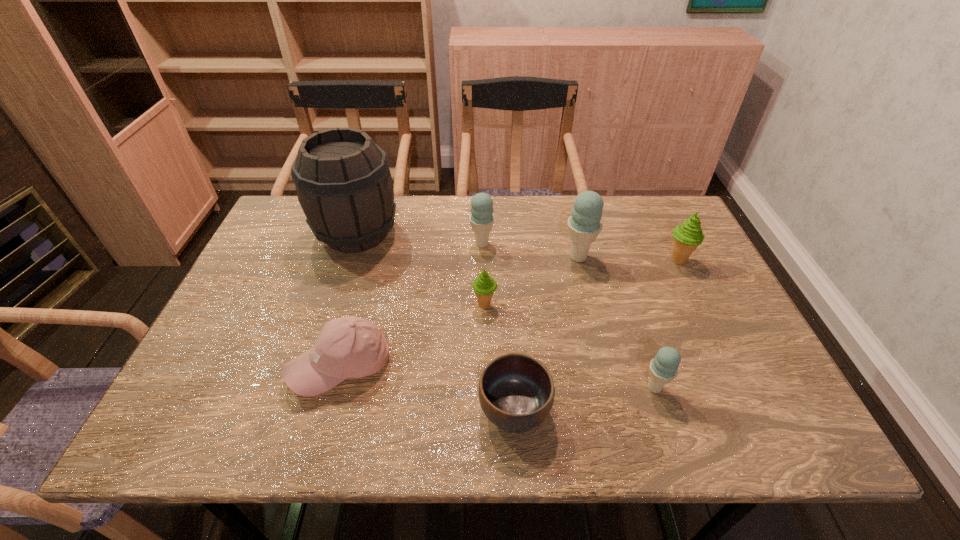
This screenshot has height=540, width=960. In order to click on wine bucket in this screenshot , I will do `click(343, 182)`.

The image size is (960, 540). I want to click on the third icecream from right to left, so click(584, 224).

This screenshot has height=540, width=960. I want to click on the third object from right to left, so click(x=584, y=224).

Image resolution: width=960 pixels, height=540 pixels. What are the coordinates of `the leftmost blue ice cream` in the screenshot? It's located at (481, 218).

Where is `the farther green icecream`? the farther green icecream is located at coordinates (688, 236).

At what (x,y) coordinates should I click in order to perform the action: click on the right green icecream. Please return your answer as a coordinate pair (x, y). Image resolution: width=960 pixels, height=540 pixels. Looking at the image, I should click on (688, 236).

The width and height of the screenshot is (960, 540). Identify the location of the nearest icecream. (663, 368).

Identify the location of the rightmost blue ice cream. Image resolution: width=960 pixels, height=540 pixels. pos(663,368).

Find the location of `the second nearest icecream`. the second nearest icecream is located at coordinates (484, 286).

Locate an element on the screen. the smaller green icecream is located at coordinates (484, 286).